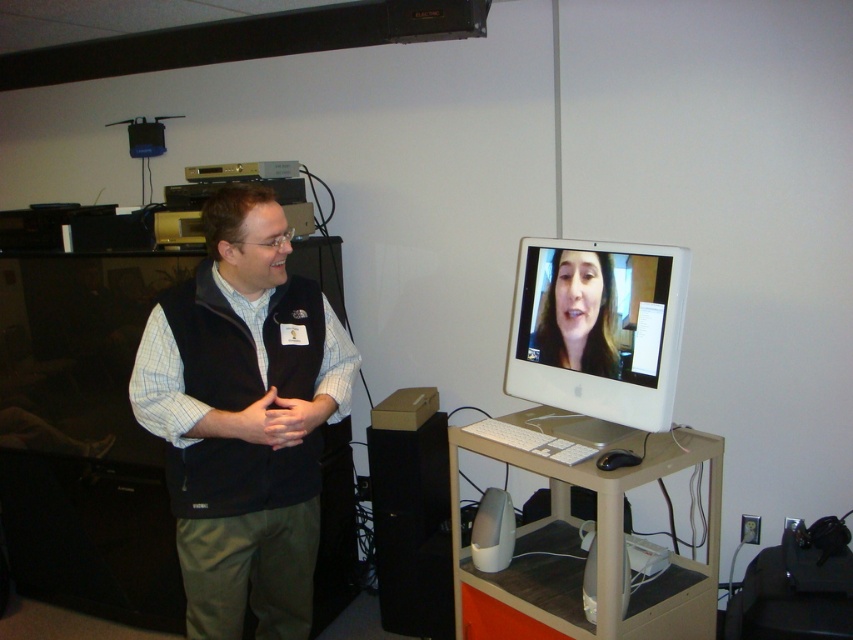
This screenshot has width=853, height=640. What are the coordinates of `white glossy computer monitor at center` in the screenshot? It's located at (598, 328).

Can you confirm if white glossy computer monitor at center is positioned below smooth skin face at center?

Correct, white glossy computer monitor at center is located below smooth skin face at center.

Does point (647, 412) lie in front of point (560, 262)?

Yes, it is.

Locate an element on the screen. Image resolution: width=853 pixels, height=640 pixels. white glossy computer monitor at center is located at coordinates (598, 328).

Does point (194, 376) come behind point (608, 477)?

No.

Identify the location of black fleece vest at left. The height and width of the screenshot is (640, 853). (244, 419).

Is black fleece vest at left positioned at the back of white glossy computer monitor at center?

No, it is not.

Locate an element on the screen. The image size is (853, 640). black fleece vest at left is located at coordinates (244, 419).